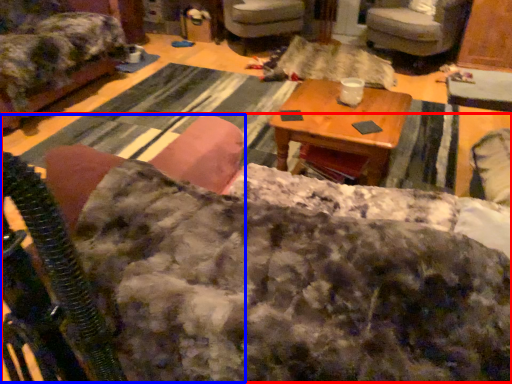
Question: Which object is further to the camera taking this photo, couch (highlighted by a red box) or rocking chair (highlighted by a blue box)?

Choices:
 (A) couch
 (B) rocking chair

Answer: (A)